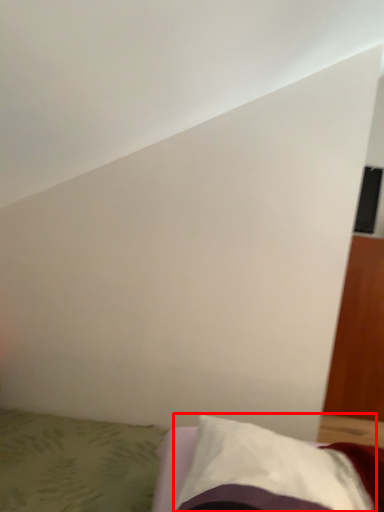
Question: From the image, what is the correct spatial relationship of pillow (annotated by the red box) in relation to bed?

Choices:
 (A) left
 (B) right

Answer: (B)